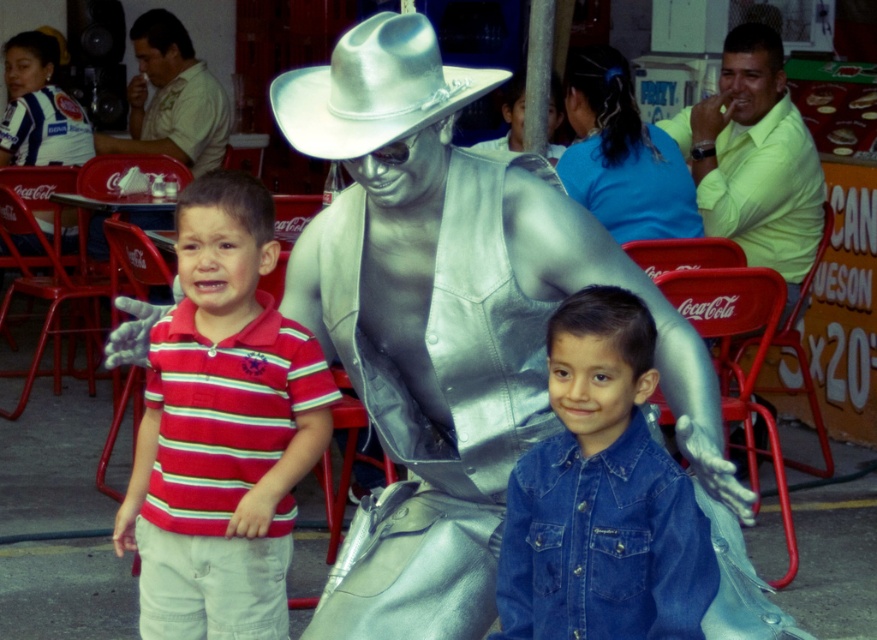
You are standing at the center of the image and see the point at coordinates (222, 428). Which object is this point located on?

The point at coordinates (222, 428) is located on the striped cotton shirt at left.

Consider the image. Based on the scene description, which object is taller between the silver metallic cowboy at center and the striped cotton shirt at left?

The silver metallic cowboy at center is much taller than the striped cotton shirt at left.

You are standing in the outdoor event area and notice two points marked in the image. Which point, point (662,593) or point (822,179), is nearer to you?

Point (662,593) is closer to the viewer than point (822,179).